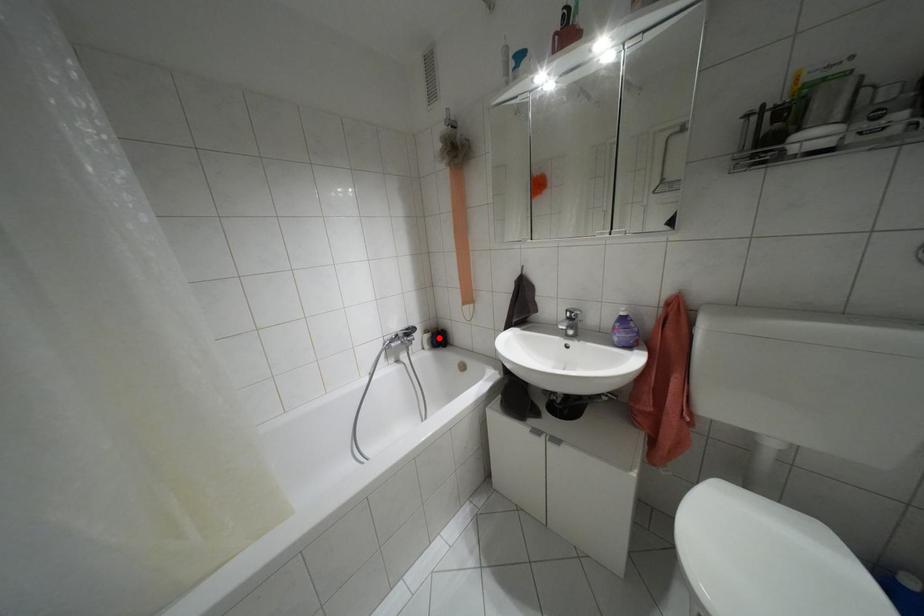
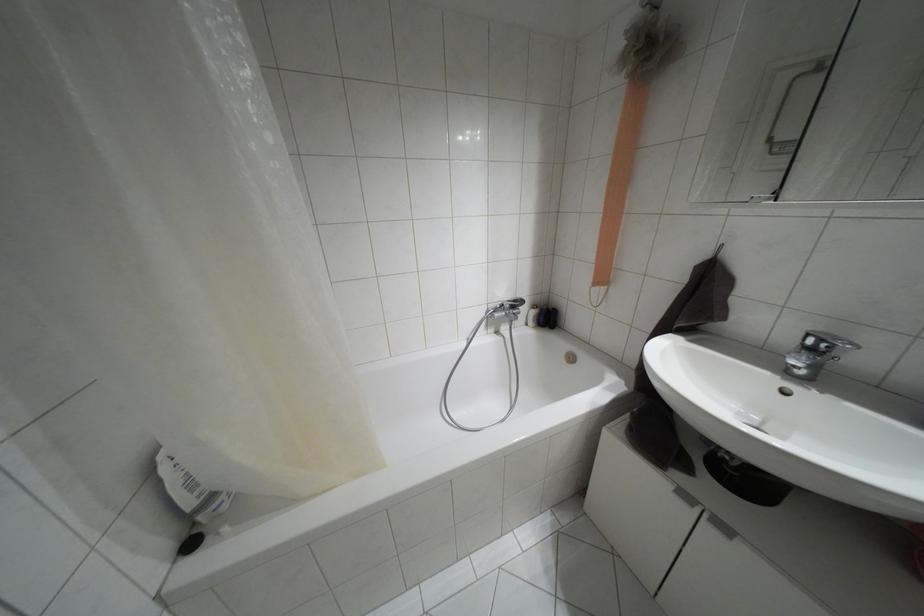
Locate, in the second image, the point that corresponds to the highlighted location in the first image.

(546, 317)